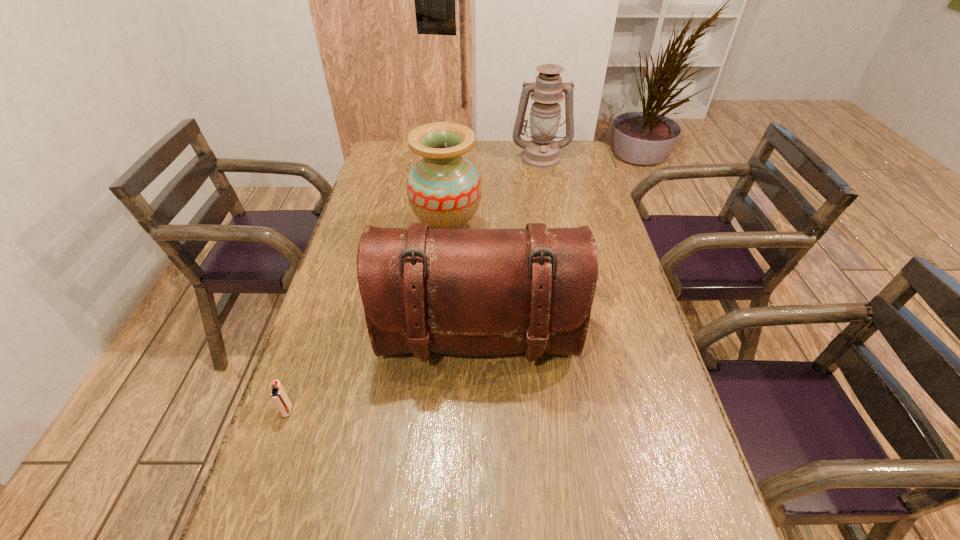
Where is `object that is positioned at the left edge`? The width and height of the screenshot is (960, 540). object that is positioned at the left edge is located at coordinates (278, 395).

At what (x,y) coordinates should I click in order to perform the action: click on object positioned at the right edge. Please return your answer as a coordinate pair (x, y). This screenshot has width=960, height=540. Looking at the image, I should click on (542, 152).

This screenshot has height=540, width=960. What are the coordinates of `object present at the far right corner` in the screenshot? It's located at (542, 152).

The image size is (960, 540). What are the coordinates of `vacant area at the far edge of the desktop` in the screenshot? It's located at (509, 150).

Find the location of a particular element. free spot at the left edge of the desktop is located at coordinates (343, 302).

Find the location of a particular element. free region at the right edge of the desktop is located at coordinates (592, 198).

In the image, there is a desktop. Identify the location of vacant space at the far left corner. Image resolution: width=960 pixels, height=540 pixels. (396, 170).

This screenshot has height=540, width=960. In the image, there is a desktop. In order to click on free region at the far right corner in this screenshot , I will do [x=587, y=156].

Image resolution: width=960 pixels, height=540 pixels. In order to click on free spot between the nearest object and the satchel in this screenshot , I will do `click(383, 375)`.

Find the location of a particular element. free spot between the third farthest object and the nearest object is located at coordinates (383, 375).